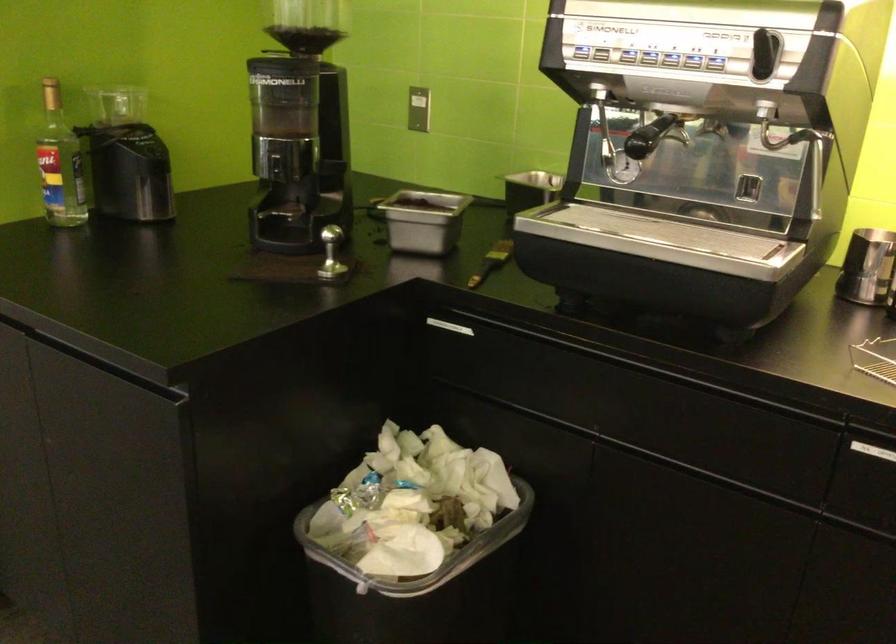
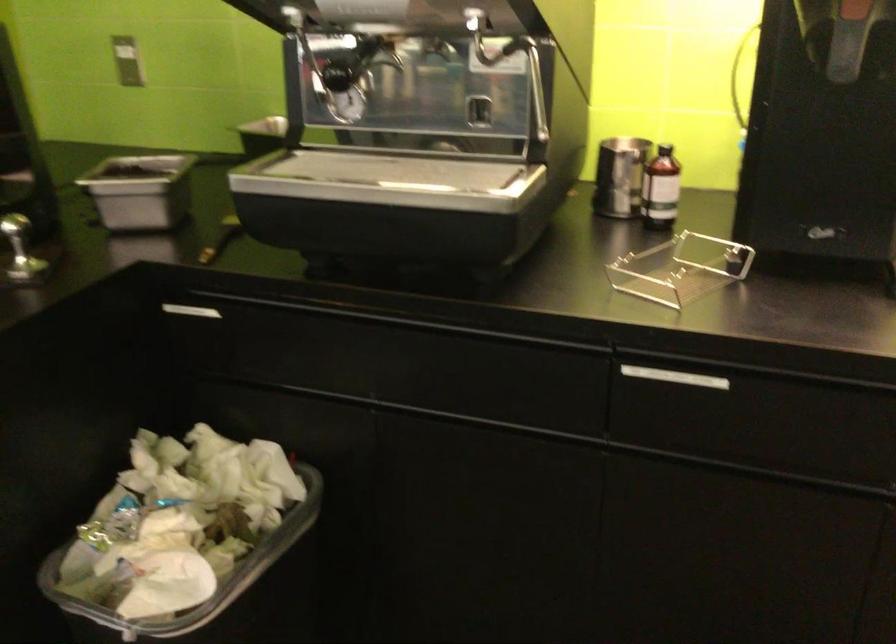
In the second image, find the point that corresponds to the point at 446,326 in the first image.

(192, 310)